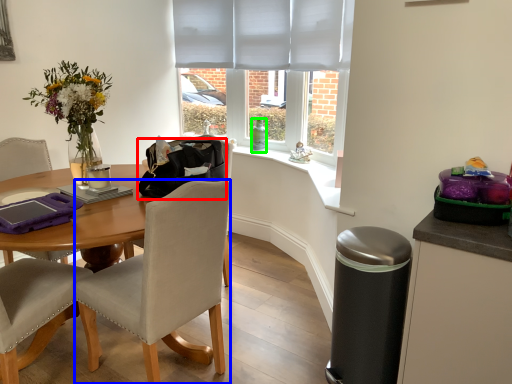
Question: Which object is the closest to the handbag (highlighted by a red box)? Choose among these: chair (highlighted by a blue box) or bottle (highlighted by a green box).

Choices:
 (A) chair
 (B) bottle

Answer: (A)